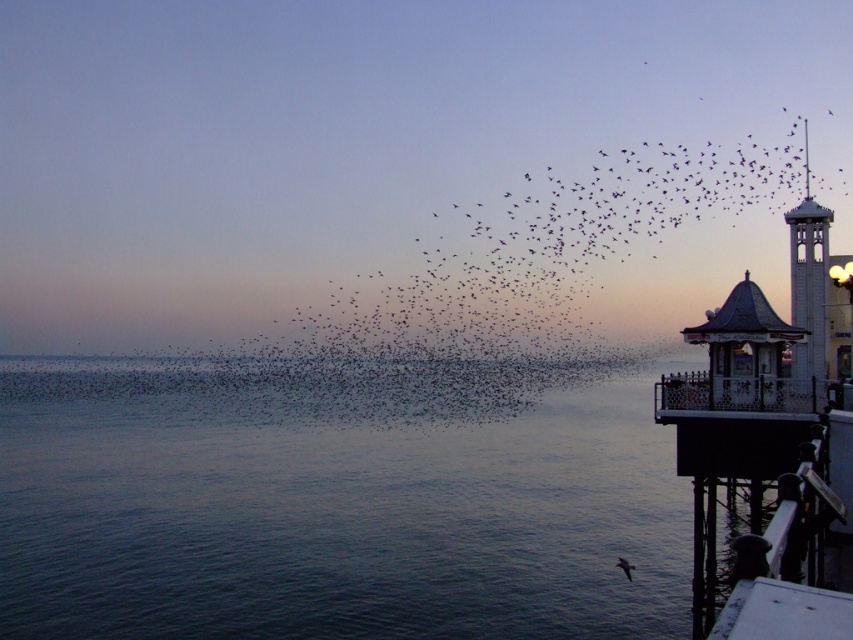
You are standing on the beach and see the clear water at lower left and the black matte birds at upper center. Which object is closer to the left side of your view?

The clear water at lower left is closer to the left side of the view as it is positioned to the left of the black matte birds at upper center.

You are a birdwatcher standing on the wooden railing at right and want to observe the dark gray feathered bird at lower right. Which direction should you look to see the bird?

The wooden railing at right is positioned on the right side of dark gray feathered bird at lower right, so you should look to your left to see the bird.

You are a birdwatcher standing at the edge of the water, observing the black matte birds at upper center and the white wooden bell tower at right. You want to know if you can safely walk between them without getting your feet wet. Can you do so?

The black matte birds at upper center and the white wooden bell tower at right are 58.30 meters apart from each other. Since you are standing at the edge of the water, the distance between them is over 58 meters, so you can safely walk between them without getting your feet wet.